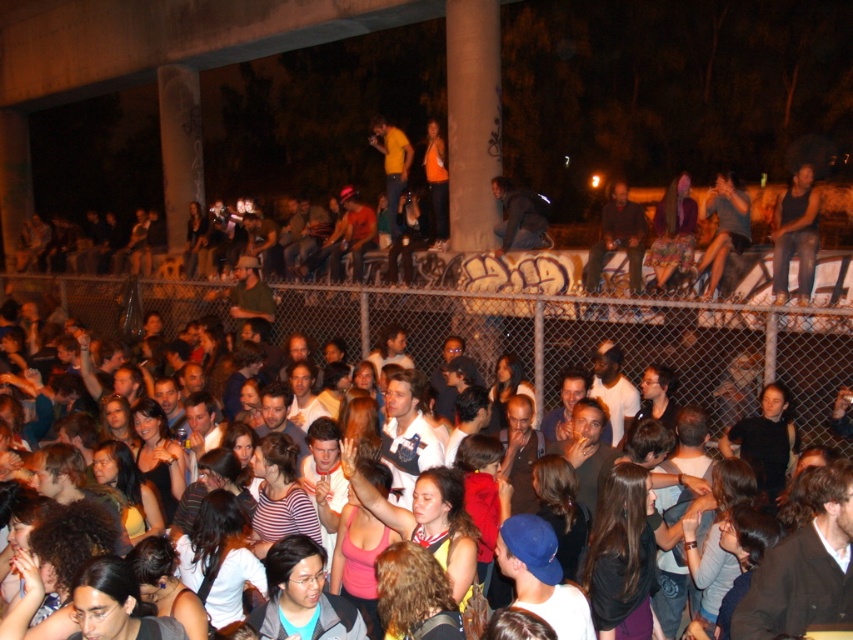
Question: Is multicolored casual clothing at center thinner than dark brown leather jacket at upper right?

Choices:
 (A) yes
 (B) no

Answer: (B)

Question: Which of these objects is positioned farthest from the black tank top at upper right?

Choices:
 (A) matte black jacket at upper right
 (B) multicolored casual clothing at center
 (C) dark brown leather jacket at upper right

Answer: (B)

Question: Is black tank top at upper right closer to the viewer compared to matte black jacket at upper right?

Choices:
 (A) yes
 (B) no

Answer: (A)

Question: Based on their relative distances, which object is nearer to the multicolored casual clothing at center?

Choices:
 (A) dark brown leather jacket at upper right
 (B) black tank top at upper right
 (C) matte black jacket at upper right

Answer: (A)

Question: Which is farther from the dark brown leather jacket at upper right?

Choices:
 (A) black tank top at upper right
 (B) matte black jacket at upper right

Answer: (A)

Question: Is multicolored casual clothing at center wider than black tank top at upper right?

Choices:
 (A) no
 (B) yes

Answer: (B)